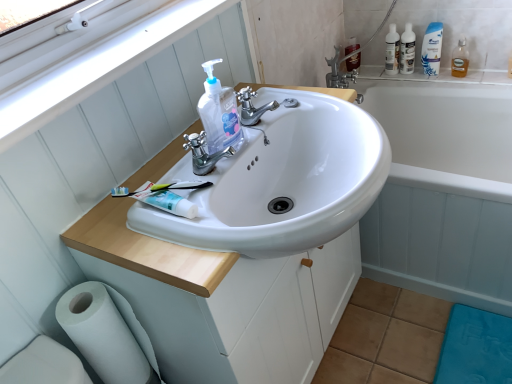
The width and height of the screenshot is (512, 384). What are the coordinates of `free space to the left of white glossy shampoo bottle at upper right, which is the 3th cleaning product from bottom to top` in the screenshot? It's located at (401, 71).